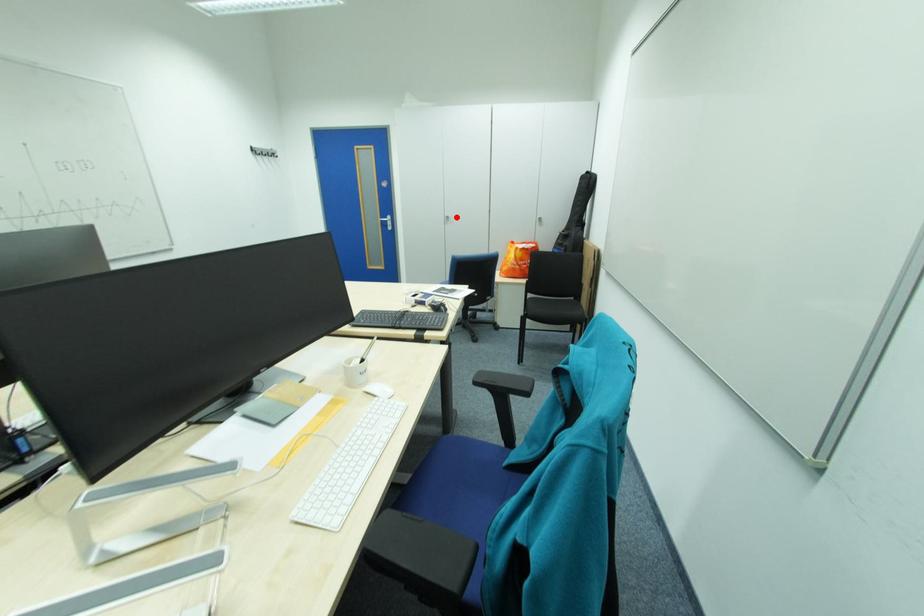
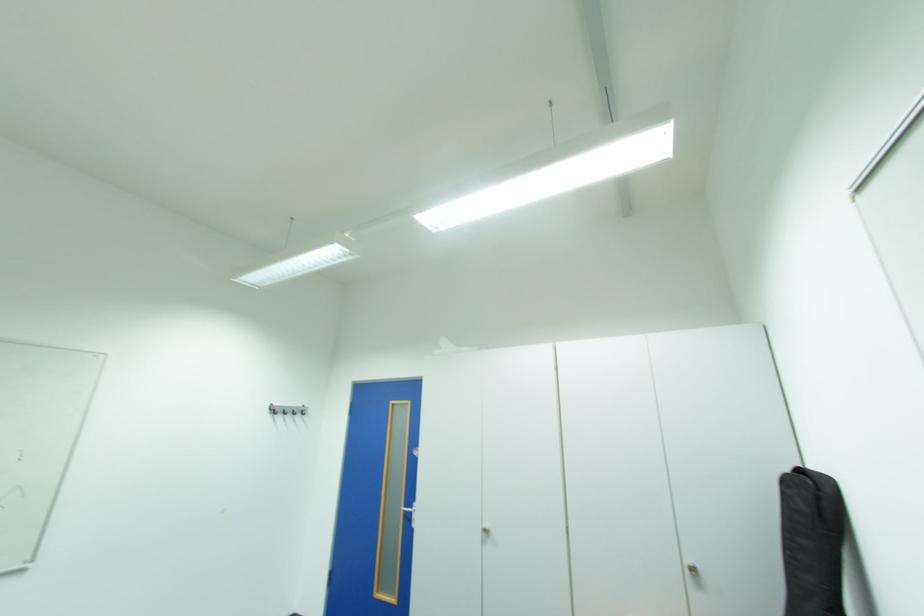
Locate, in the second image, the point that corresponds to the highlighted location in the first image.

(495, 532)